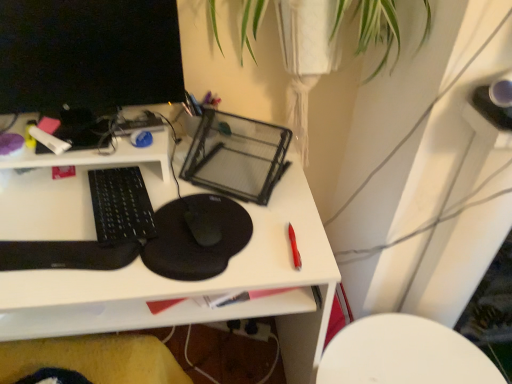
Locate an element on the screen. The width and height of the screenshot is (512, 384). vacant area that lies in front of black matte mouse at center is located at coordinates (182, 265).